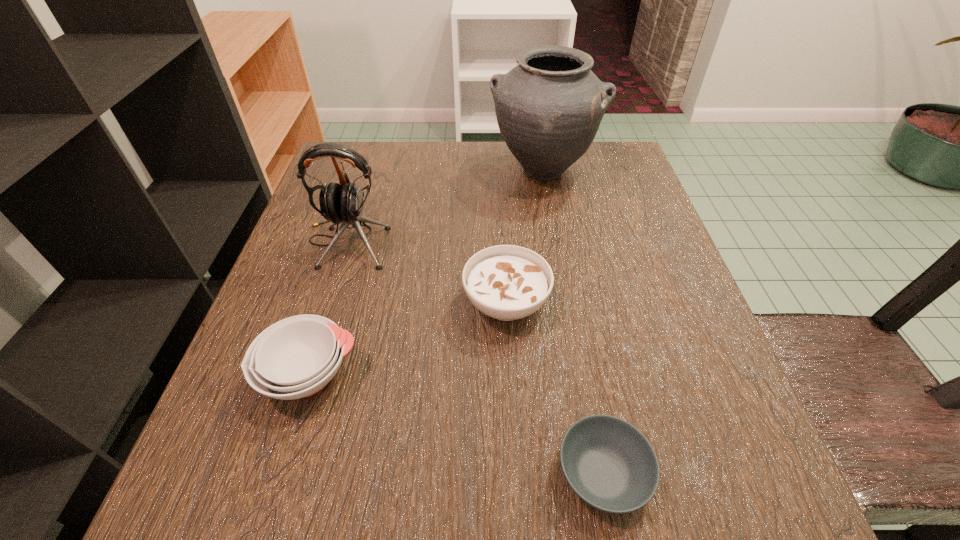
The height and width of the screenshot is (540, 960). Identify the location of urn. (549, 107).

This screenshot has height=540, width=960. I want to click on earphone, so click(x=343, y=203).

You are a GUI agent. You are given a task and a screenshot of the screen. Output one action in this format:
    pyautogui.click(x=<x>, y=<y>)
    Task: Click on the second farthest object
    The height and width of the screenshot is (540, 960).
    Given the screenshot: What is the action you would take?
    pyautogui.click(x=343, y=203)

Find the location of a particular element. the leftmost soup bowl is located at coordinates (296, 357).

Locate an element on the screen. The image size is (960, 540). the nearest soup bowl is located at coordinates (609, 464).

At what (x,y) coordinates should I click in order to perform the action: click on the shortest soup bowl. Please return your answer as a coordinate pair (x, y). The height and width of the screenshot is (540, 960). Looking at the image, I should click on (609, 464).

Locate an element on the screen. vacant area located on the left of the urn is located at coordinates (332, 170).

In order to click on free location located 0.280m on the front of the earphone in this screenshot , I will do `click(294, 412)`.

You are a GUI agent. You are given a task and a screenshot of the screen. Output one action in this format:
    pyautogui.click(x=<x>, y=<y>)
    Task: Click on the free point located on the back of the leftmost soup bowl
    This screenshot has height=540, width=960.
    Given the screenshot: What is the action you would take?
    pyautogui.click(x=338, y=284)

Locate an element on the screen. free spot located 0.140m on the back of the shortest soup bowl is located at coordinates (578, 345).